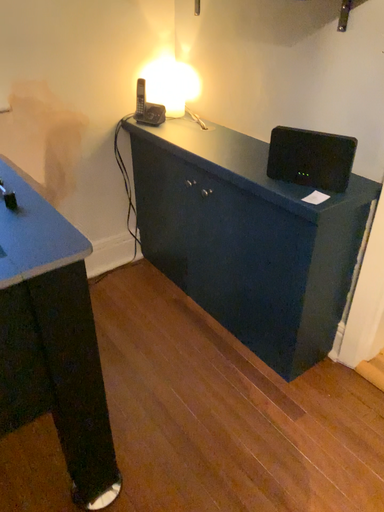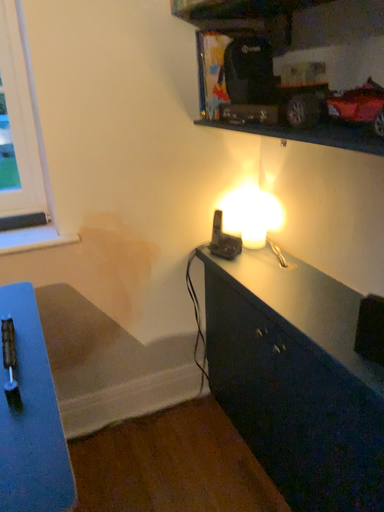
Question: How did the camera likely rotate when shooting the video?

Choices:
 (A) rotated downward
 (B) rotated upward

Answer: (B)